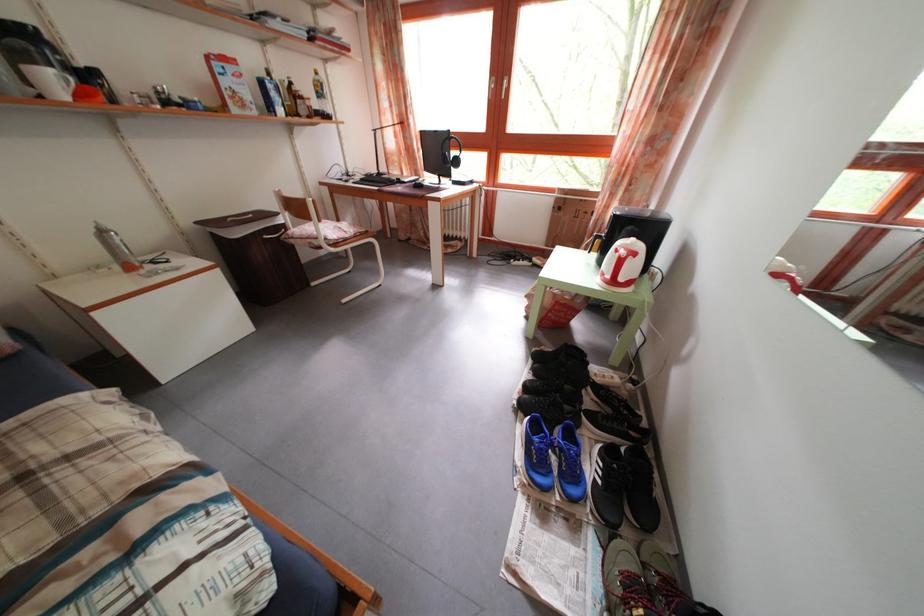
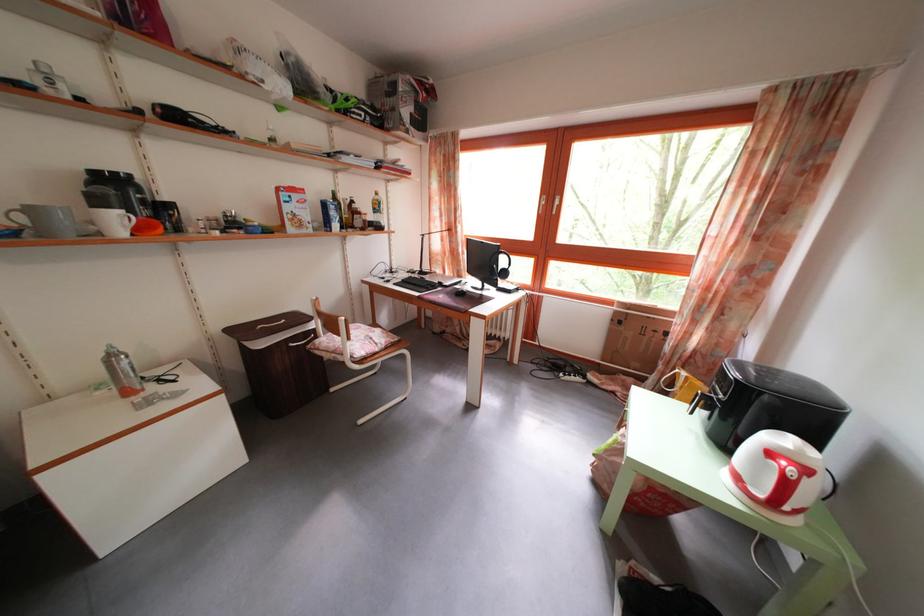
The point at (641, 262) is marked in the first image. Where is the corresponding point in the second image?

(812, 477)